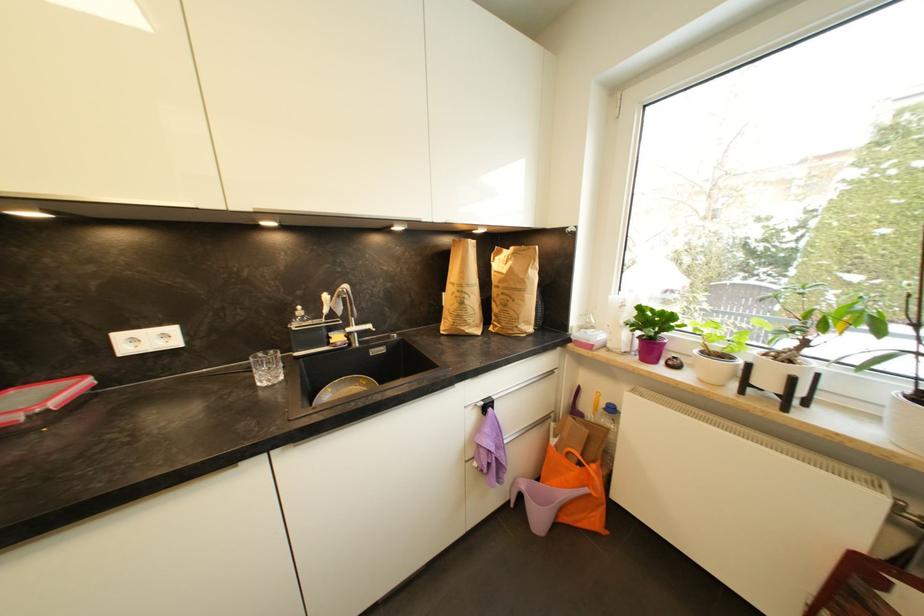
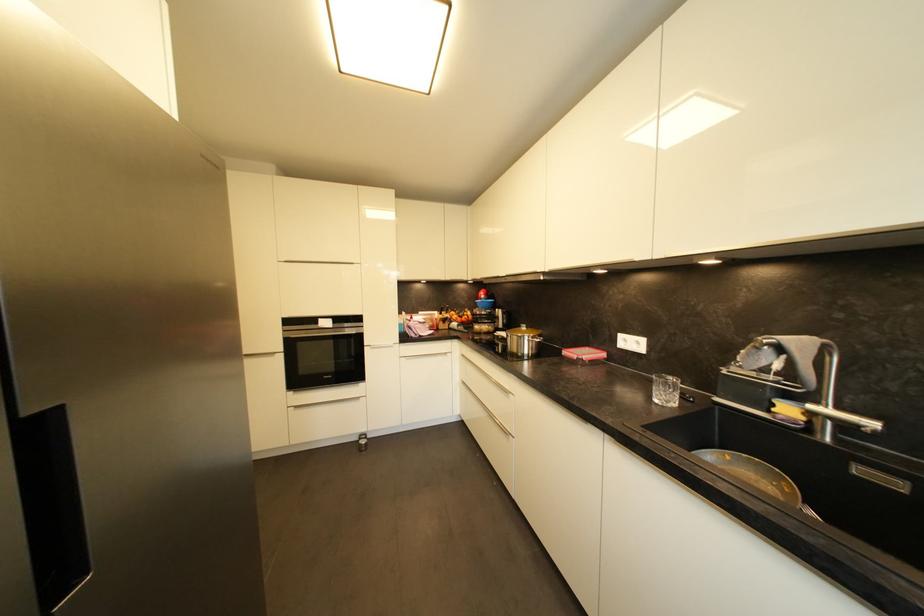
Find the pixel in the second image that matches pixel 343 339 in the first image.

(793, 411)